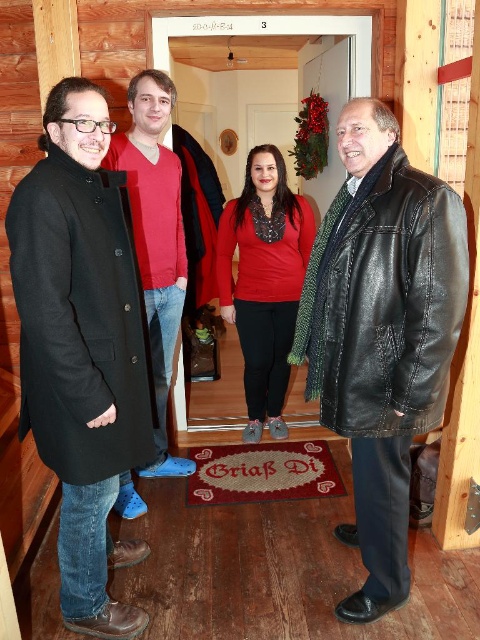
Question: Which object is positioned farthest from the matte red sweater at left?

Choices:
 (A) black leather coat at right
 (B) matte red sweater at center

Answer: (A)

Question: Can you confirm if matte black coat at left is bigger than matte red sweater at center?

Choices:
 (A) no
 (B) yes

Answer: (B)

Question: Is the position of matte black coat at left less distant than that of black leather coat at right?

Choices:
 (A) no
 (B) yes

Answer: (B)

Question: Based on their relative distances, which object is nearer to the black leather coat at right?

Choices:
 (A) matte black coat at left
 (B) matte red sweater at left
 (C) matte red sweater at center

Answer: (A)

Question: Is matte black coat at left thinner than matte red sweater at center?

Choices:
 (A) yes
 (B) no

Answer: (A)

Question: Which point is farther to the camera?

Choices:
 (A) [398, 232]
 (B) [36, 344]

Answer: (A)